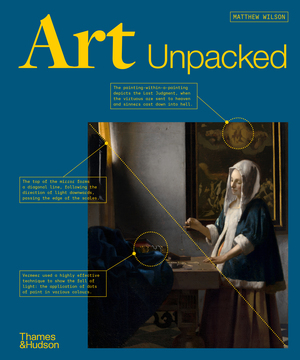
This screenshot has width=300, height=360. In order to click on painting frame in this screenshot , I will do coord(279,167).